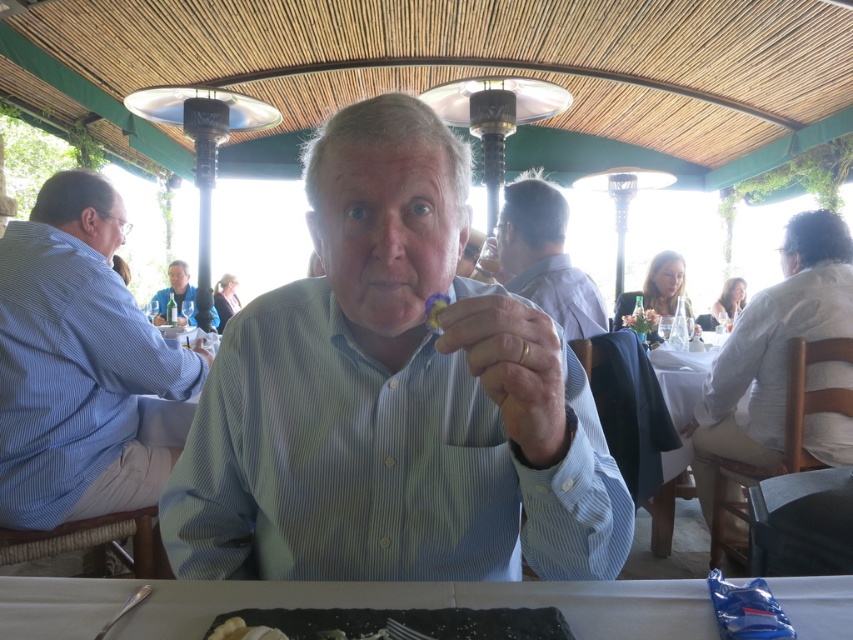
You are a customer at this outdoor restaurant and want to place your napkin on the white glossy table at lower center. However, there is a green leafy salad at center in the way. Can you place the napkin on the table without moving the salad?

The white glossy table at lower center is positioned under the green leafy salad at center, so the salad is blocking access to the table. You would need to move the salad to place the napkin on the table.

You are a customer at this outdoor restaurant and want to place your napkin on the table. If you place it next to the green leafy salad at center, where should you put it relative to the light blue striped shirt at center?

The light blue striped shirt at center is below the green leafy salad at center, so placing the napkin next to the green leafy salad at center would mean putting it above the light blue striped shirt at center.

Consider the image. You are a person who is 6 feet tall and standing in front of the white glossy table at lower center. If the table is 22.61 inches away from you, can you comfortably reach the edge of the table without moving your feet?

The white glossy table at lower center is 22.61 inches away from the viewer. Since an average person can comfortably reach about 24 inches from their body, you can comfortably reach the edge of the white glossy table at lower center without moving your feet.